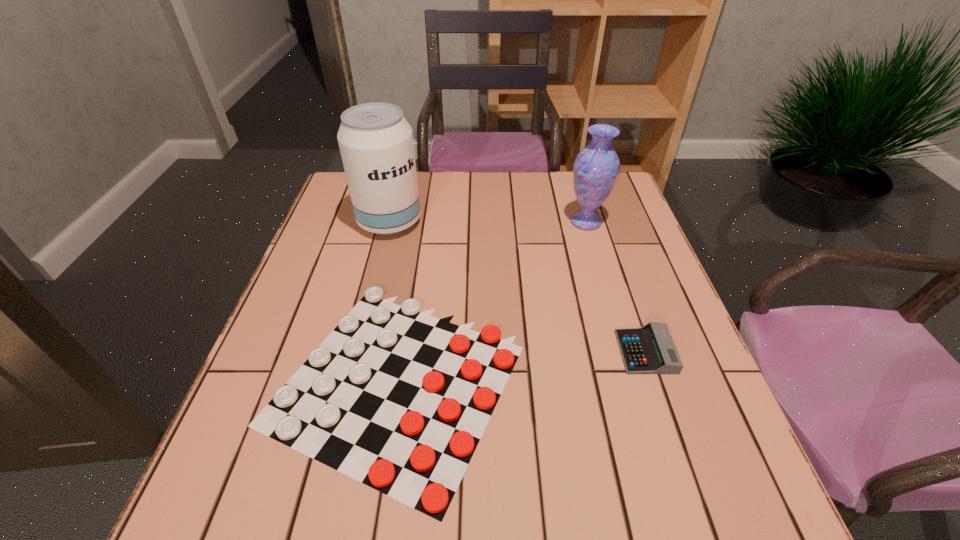
The height and width of the screenshot is (540, 960). In order to click on object at the near edge in this screenshot , I will do (394, 398).

The height and width of the screenshot is (540, 960). In order to click on alcohol that is at the left edge in this screenshot , I will do `click(375, 140)`.

Find the location of a particular element. This screenshot has height=540, width=960. checkerboard that is at the left edge is located at coordinates click(394, 398).

Identify the location of vase that is at the right edge. The width and height of the screenshot is (960, 540). (595, 170).

Locate an element on the screen. The width and height of the screenshot is (960, 540). calculator at the right edge is located at coordinates (650, 349).

Where is `object that is at the far left corner`? The height and width of the screenshot is (540, 960). object that is at the far left corner is located at coordinates (375, 140).

I want to click on object that is at the near left corner, so click(394, 398).

The width and height of the screenshot is (960, 540). I want to click on object present at the far right corner, so click(595, 170).

Where is `free space at the far edge of the desktop`? The image size is (960, 540). free space at the far edge of the desktop is located at coordinates pos(516,199).

I want to click on vacant region at the near edge, so click(x=370, y=513).